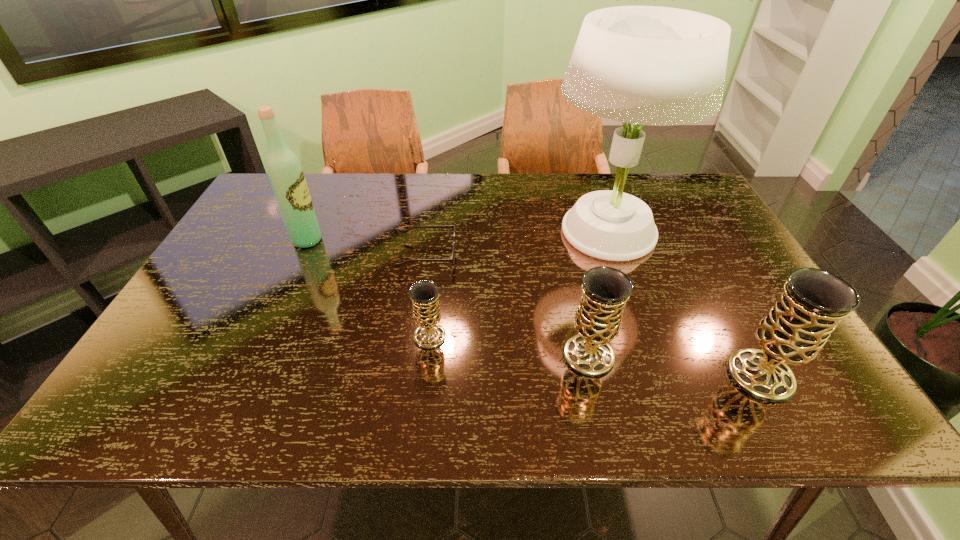
Identify the location of vacant space located on the left of the second tallest chalice. The image size is (960, 540). (432, 355).

At what (x,y) coordinates should I click in order to perform the action: click on vacant space situated 0.220m on the left of the rightmost chalice. Please return your answer as a coordinate pair (x, y). Image resolution: width=960 pixels, height=540 pixels. Looking at the image, I should click on (626, 376).

Find the location of a particular element. Image resolution: width=960 pixels, height=540 pixels. free point located 0.390m on the front-facing side of the tallest object is located at coordinates (414, 231).

Where is `vacant region located 0.400m on the front-facing side of the tallest object`? The width and height of the screenshot is (960, 540). vacant region located 0.400m on the front-facing side of the tallest object is located at coordinates (411, 231).

You are a GUI agent. You are given a task and a screenshot of the screen. Output one action in this format:
    pyautogui.click(x=<x>, y=<y>)
    Task: Click on the vacant region located on the front-facing side of the tallest object
    
    Given the screenshot: What is the action you would take?
    pyautogui.click(x=494, y=231)

Where is `free region located 0.350m on the front lenses of the sunglasses`? free region located 0.350m on the front lenses of the sunglasses is located at coordinates (581, 255).

Locate an element on the screen. The width and height of the screenshot is (960, 540). free space located 0.300m on the front-facing side of the wine bottle is located at coordinates (425, 240).

Where is `object situated at the far edge`? object situated at the far edge is located at coordinates (647, 65).

This screenshot has height=540, width=960. I want to click on object present at the right edge, so click(x=813, y=302).

Where is `object at the near right corner`? Image resolution: width=960 pixels, height=540 pixels. object at the near right corner is located at coordinates (813, 302).